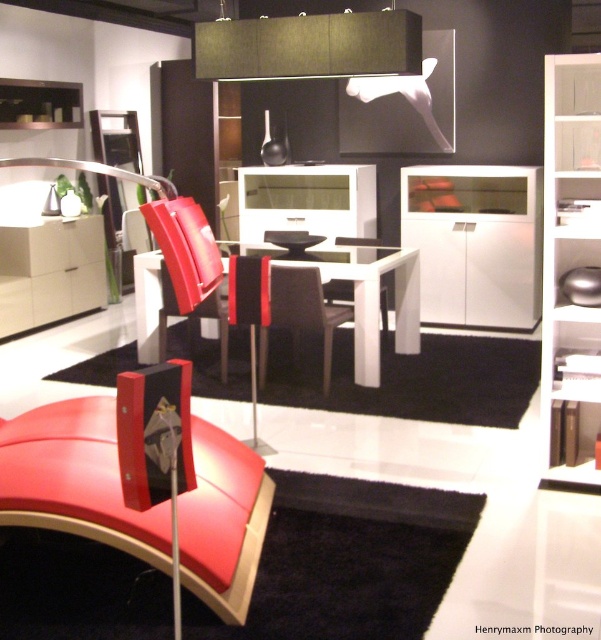
Question: Which object is positioned farthest from the white matte cabinet at center?

Choices:
 (A) white glossy armchair at center
 (B) white glossy table at center

Answer: (A)

Question: Among these points, which one is nearest to the camera?

Choices:
 (A) (147, 278)
 (B) (300, 298)
 (C) (519, 289)

Answer: (B)

Question: Is white matte cabinet at center above white glossy table at center?

Choices:
 (A) no
 (B) yes

Answer: (B)

Question: Is white matte cabinet at center above white glossy table at center?

Choices:
 (A) no
 (B) yes

Answer: (B)

Question: Which is farther from the black leather armchair at center?

Choices:
 (A) white glossy armchair at center
 (B) white matte cabinet at center

Answer: (B)

Question: Can you confirm if white matte cabinet at center is bigger than white glossy armchair at center?

Choices:
 (A) yes
 (B) no

Answer: (A)